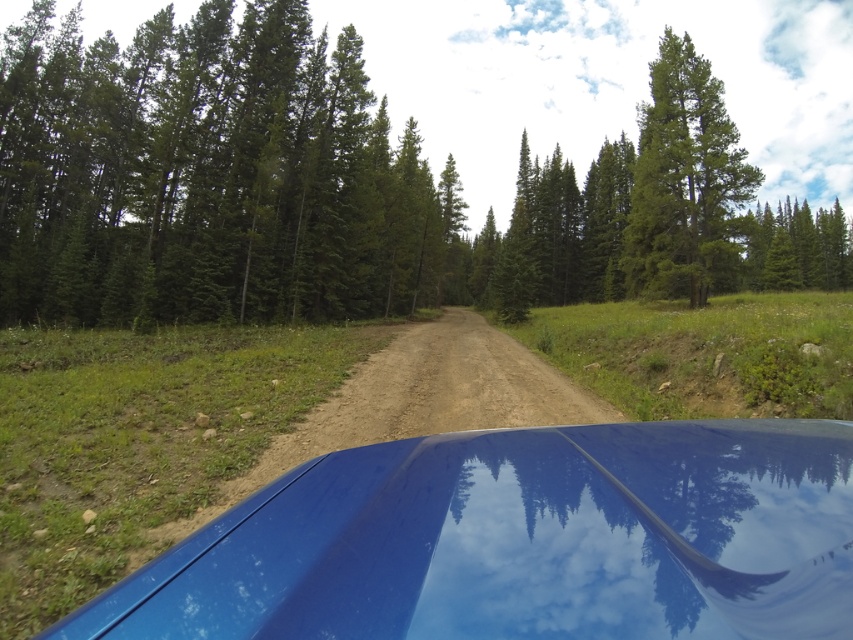
Question: Which of these objects is positioned closest to the green matte tree at upper right?

Choices:
 (A) glossy blue car at center
 (B) green matte tree at center

Answer: (B)

Question: Does glossy blue car at center have a larger size compared to green matte tree at upper right?

Choices:
 (A) yes
 (B) no

Answer: (B)

Question: Which is farther from the glossy blue car at center?

Choices:
 (A) green matte tree at upper right
 (B) green matte tree at center

Answer: (B)

Question: Is glossy blue car at center behind green matte tree at upper right?

Choices:
 (A) yes
 (B) no

Answer: (B)

Question: Considering the relative positions of green matte tree at center and green matte tree at upper right in the image provided, where is green matte tree at center located with respect to green matte tree at upper right?

Choices:
 (A) below
 (B) above

Answer: (A)

Question: Which object is farther from the camera taking this photo?

Choices:
 (A) green matte tree at upper right
 (B) green matte tree at center
 (C) glossy blue car at center

Answer: (A)